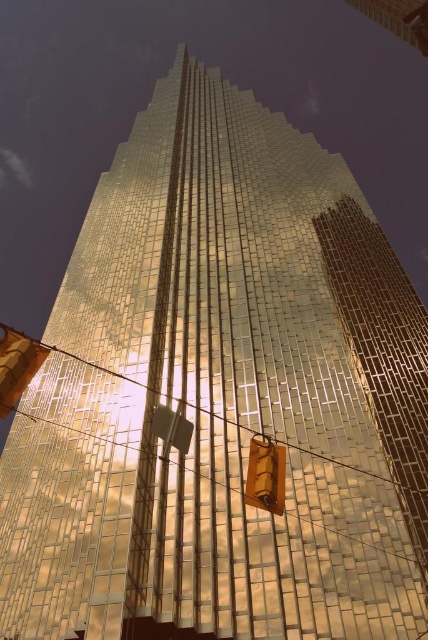
Which is above, matte orange traffic light at lower left or metallic gold traffic light at center?

matte orange traffic light at lower left is higher up.

Can you confirm if matte orange traffic light at lower left is positioned to the right of metallic gold traffic light at center?

No, matte orange traffic light at lower left is not to the right of metallic gold traffic light at center.

The image size is (428, 640). Describe the element at coordinates (17, 365) in the screenshot. I see `matte orange traffic light at lower left` at that location.

I want to click on matte orange traffic light at lower left, so click(x=17, y=365).